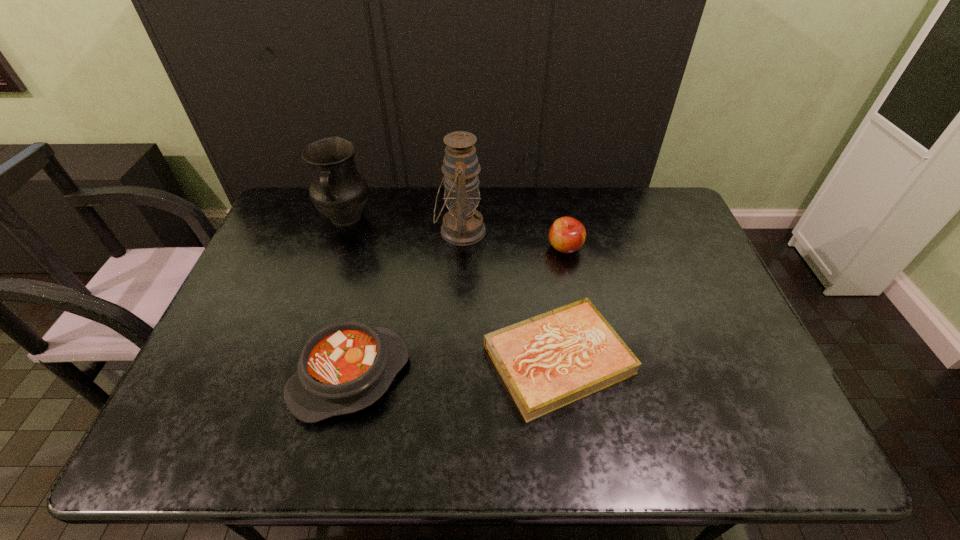
Image resolution: width=960 pixels, height=540 pixels. What are the coordinates of `free space at the far left corner` in the screenshot? It's located at (300, 214).

In the image, there is a desktop. Where is `free space at the near left corner`? Image resolution: width=960 pixels, height=540 pixels. free space at the near left corner is located at coordinates (198, 423).

You are a GUI agent. You are given a task and a screenshot of the screen. Output one action in this format:
    pyautogui.click(x=<x>, y=<y>)
    Task: Click on the free space between the apple and the casserole
    The width and height of the screenshot is (960, 540).
    Given the screenshot: What is the action you would take?
    pyautogui.click(x=458, y=312)

Locate an element on the screen. The image size is (960, 540). vacant point located between the second tallest object and the shortest object is located at coordinates (452, 289).

Locate an element on the screen. The height and width of the screenshot is (540, 960). vacant area between the hardback book and the tallest object is located at coordinates (510, 295).

What are the coordinates of `unoccupied position between the second tallest object and the casserole` in the screenshot? It's located at (348, 297).

You are a GUI agent. You are given a task and a screenshot of the screen. Output one action in this format:
    pyautogui.click(x=<x>, y=<y>)
    Task: Click on the empty space that is in between the tallest object and the apple
    Image resolution: width=960 pixels, height=540 pixels.
    Given the screenshot: What is the action you would take?
    pyautogui.click(x=513, y=239)

This screenshot has width=960, height=540. In order to click on vacant space in between the second tallest object and the tallest object in this screenshot , I will do `click(403, 225)`.

The width and height of the screenshot is (960, 540). Find the location of `free space between the shortest object and the pitcher`. free space between the shortest object and the pitcher is located at coordinates (452, 289).

Identify the location of vacant point located between the pitcher and the hardback book. This screenshot has height=540, width=960. (452, 289).